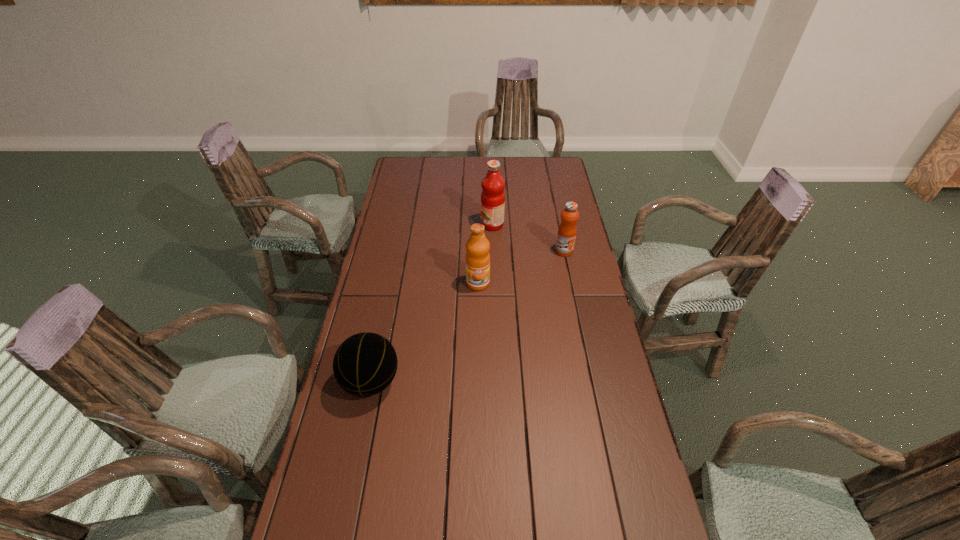
In order to click on the farthest object in this screenshot , I will do `click(492, 196)`.

This screenshot has width=960, height=540. I want to click on the second nearest object, so click(x=477, y=258).

Find the location of a particular element. The image size is (960, 540). the third tallest object is located at coordinates (567, 230).

Find the location of a particular element. This screenshot has height=540, width=960. the second nearest fruit juice is located at coordinates (567, 230).

Image resolution: width=960 pixels, height=540 pixels. I want to click on the shortest object, so click(365, 364).

Identify the location of the nearest object. The image size is (960, 540). (365, 364).

The width and height of the screenshot is (960, 540). Identify the location of free space located 0.290m on the front label of the farthest fruit juice. tap(414, 225).

This screenshot has width=960, height=540. What are the coordinates of `vacant space positioned 0.070m on the front label of the farthest fruit juice` in the screenshot? It's located at (465, 225).

The width and height of the screenshot is (960, 540). Find the location of `vacant region located 0.150m on the front label of the farthest fruit juice`. vacant region located 0.150m on the front label of the farthest fruit juice is located at coordinates (446, 225).

This screenshot has height=540, width=960. Find the location of `vacant area situated 0.320m on the label side of the nearest fruit juice`. vacant area situated 0.320m on the label side of the nearest fruit juice is located at coordinates (477, 364).